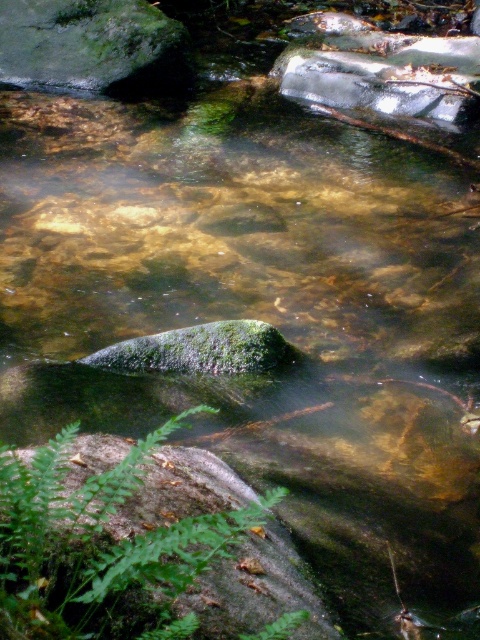
Does green fuzzy fern at lower left have a greater width compared to green mossy rock at upper left?

No.

Does point (16, 529) come in front of point (133, 10)?

Yes.

Where is `green fuzzy fern at lower left`? This screenshot has height=640, width=480. green fuzzy fern at lower left is located at coordinates (100, 547).